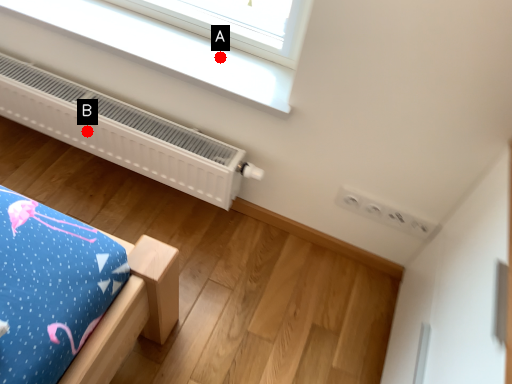
Question: Two points are circled on the image, labeled by A and B beside each circle. Among these points, which one is farthest from the camera?

Choices:
 (A) A is further
 (B) B is further

Answer: (B)